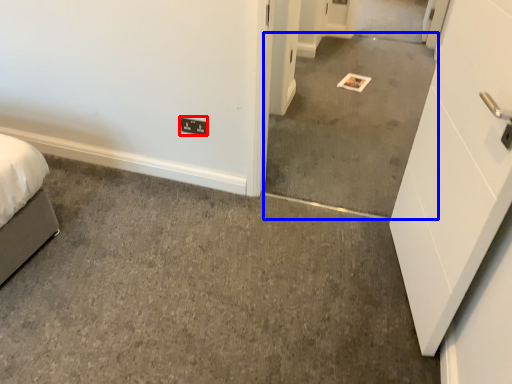
Question: Among these objects, which one is farthest to the camera, light switch (highlighted by a red box) or concrete (highlighted by a blue box)?

Choices:
 (A) light switch
 (B) concrete

Answer: (A)